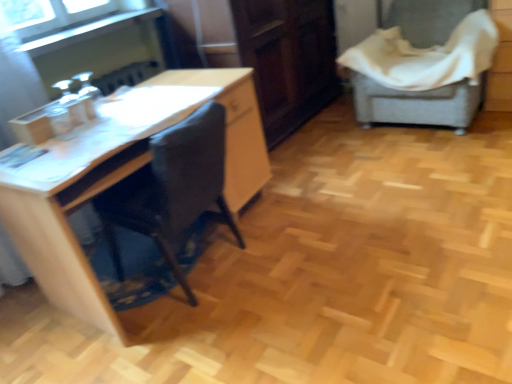
Question: Are dark wood/file cabinet at center and clear glass window at upper left beside each other?

Choices:
 (A) yes
 (B) no

Answer: (B)

Question: From the image's perspective, is dark wood/file cabinet at center below clear glass window at upper left?

Choices:
 (A) yes
 (B) no

Answer: (B)

Question: Can you confirm if dark wood/file cabinet at center is thinner than clear glass window at upper left?

Choices:
 (A) no
 (B) yes

Answer: (A)

Question: Considering the relative sizes of dark wood/file cabinet at center and clear glass window at upper left in the image provided, is dark wood/file cabinet at center bigger than clear glass window at upper left?

Choices:
 (A) no
 (B) yes

Answer: (B)

Question: Are dark wood/file cabinet at center and clear glass window at upper left far apart?

Choices:
 (A) yes
 (B) no

Answer: (A)

Question: Is point (412, 41) closer or farther from the camera than point (38, 231)?

Choices:
 (A) farther
 (B) closer

Answer: (A)

Question: Considering the positions of gray fabric-covered chair at right and wooden desk at left in the image, is gray fabric-covered chair at right wider or thinner than wooden desk at left?

Choices:
 (A) wide
 (B) thin

Answer: (A)

Question: Considering the positions of gray fabric-covered chair at right and wooden desk at left in the image, is gray fabric-covered chair at right taller or shorter than wooden desk at left?

Choices:
 (A) tall
 (B) short

Answer: (A)

Question: Would you say gray fabric-covered chair at right is to the left or to the right of wooden desk at left in the picture?

Choices:
 (A) right
 (B) left

Answer: (A)

Question: Looking at their shapes, would you say gray fabric-covered chair at right is wider or thinner than clear glass window at upper left?

Choices:
 (A) wide
 (B) thin

Answer: (A)

Question: Is gray fabric-covered chair at right spatially inside clear glass window at upper left, or outside of it?

Choices:
 (A) outside
 (B) inside

Answer: (A)

Question: From their relative heights in the image, would you say gray fabric-covered chair at right is taller or shorter than clear glass window at upper left?

Choices:
 (A) short
 (B) tall

Answer: (B)

Question: Considering their positions, is gray fabric-covered chair at right located in front of or behind clear glass window at upper left?

Choices:
 (A) front
 (B) behind

Answer: (B)

Question: In terms of width, does wooden desk at left look wider or thinner when compared to dark wood/file cabinet at center?

Choices:
 (A) thin
 (B) wide

Answer: (B)

Question: Is point (36, 200) positioned closer to the camera than point (256, 67)?

Choices:
 (A) closer
 (B) farther

Answer: (A)